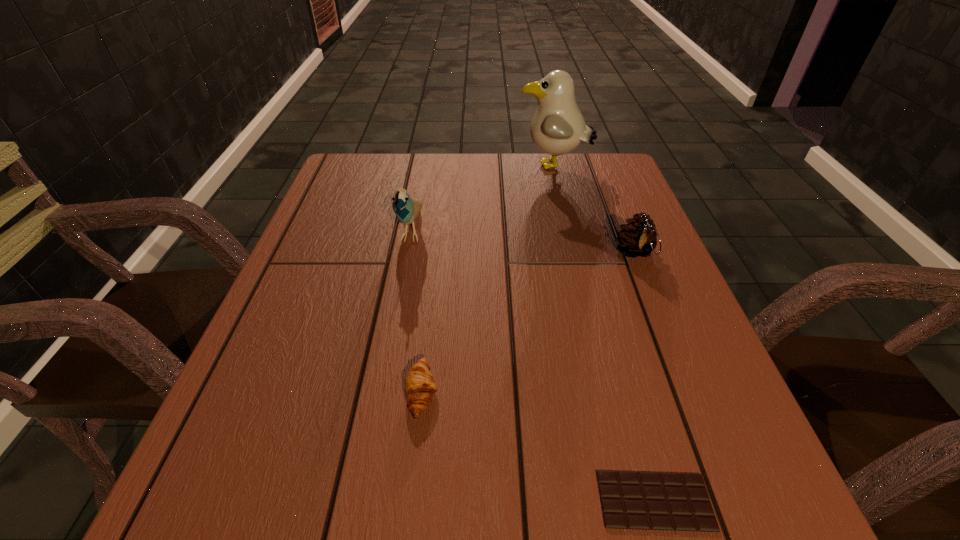
At what (x,y) coordinates should I click in order to perform the action: click on chocolate bar present at the right edge. Please return your answer as a coordinate pair (x, y). This screenshot has width=960, height=540. Looking at the image, I should click on (630, 500).

In order to click on object located in the far right corner section of the desktop in this screenshot , I will do `click(558, 127)`.

At what (x,y) coordinates should I click in order to perform the action: click on object present at the near right corner. Please return your answer as a coordinate pair (x, y). The height and width of the screenshot is (540, 960). Looking at the image, I should click on (630, 500).

Where is `vacant space at the far edge of the desktop`? The height and width of the screenshot is (540, 960). vacant space at the far edge of the desktop is located at coordinates (469, 177).

Where is `vacant space at the near edge of the desktop`? The width and height of the screenshot is (960, 540). vacant space at the near edge of the desktop is located at coordinates (498, 518).

I want to click on vacant space at the left edge of the desktop, so click(x=245, y=428).

You are a GUI agent. You are given a task and a screenshot of the screen. Output one action in this format:
    pyautogui.click(x=<x>, y=<y>)
    Task: Click on the free region at the right edge
    The width and height of the screenshot is (960, 540).
    Given the screenshot: What is the action you would take?
    point(624,210)

The height and width of the screenshot is (540, 960). What are the coordinates of `vacant space at the near left corner of the desktop` in the screenshot? It's located at (252, 483).

I want to click on blank area at the far right corner, so click(x=566, y=159).

Find the location of a particular element. blank region between the tallest object and the second tallest object is located at coordinates (483, 198).